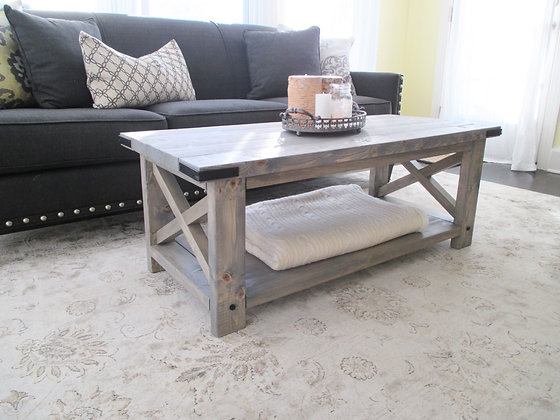
This screenshot has height=420, width=560. I want to click on tray, so click(x=334, y=122).